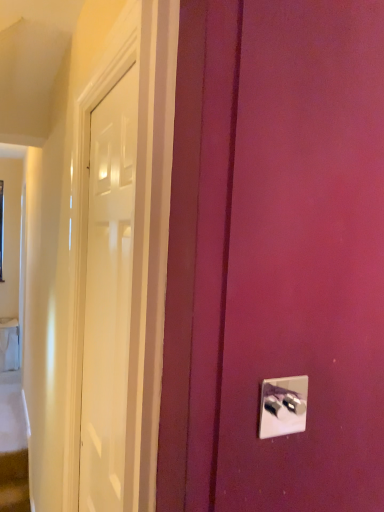
This screenshot has width=384, height=512. Describe the element at coordinates (283, 406) in the screenshot. I see `metallic silver light switch at lower right` at that location.

Image resolution: width=384 pixels, height=512 pixels. I want to click on metallic silver light switch at lower right, so click(x=283, y=406).

Image resolution: width=384 pixels, height=512 pixels. What are the coordinates of `white glossy door at left` in the screenshot? It's located at click(x=111, y=303).

What do you see at coordinates (111, 303) in the screenshot?
I see `white glossy door at left` at bounding box center [111, 303].

This screenshot has height=512, width=384. Identify the location of metallic silver light switch at lower right. (283, 406).

Which is more to the left, metallic silver light switch at lower right or white glossy door at left?

From the viewer's perspective, white glossy door at left appears more on the left side.

Who is more distant, metallic silver light switch at lower right or white glossy door at left?

white glossy door at left is further from the camera.

Is point (300, 392) less distant than point (122, 366)?

Yes.

From the image's perspective, which one is positioned lower, metallic silver light switch at lower right or white glossy door at left?

white glossy door at left.

From a real-world perspective, does metallic silver light switch at lower right stand above white glossy door at left?

Yes, from a real-world perspective, metallic silver light switch at lower right is on top of white glossy door at left.

Does metallic silver light switch at lower right have a greater width compared to white glossy door at left?

No.

Who is shorter, metallic silver light switch at lower right or white glossy door at left?

With less height is metallic silver light switch at lower right.

Is metallic silver light switch at lower right bigger than white glossy door at left?

Incorrect, metallic silver light switch at lower right is not larger than white glossy door at left.

From the picture: Is metallic silver light switch at lower right located outside white glossy door at left?

That's correct, metallic silver light switch at lower right is outside of white glossy door at left.

Can you see metallic silver light switch at lower right touching white glossy door at left?

metallic silver light switch at lower right is not next to white glossy door at left, and they're not touching.

Is metallic silver light switch at lower right positioned with its back to white glossy door at left?

Yes.

Identify the location of door behind the metallic silver light switch at lower right. (111, 303).

Considering the relative positions of white glossy door at left and metallic silver light switch at lower right in the image provided, is white glossy door at left to the left of metallic silver light switch at lower right from the viewer's perspective?

Correct, you'll find white glossy door at left to the left of metallic silver light switch at lower right.

Does white glossy door at left come in front of metallic silver light switch at lower right?

No, white glossy door at left is further to the viewer.

Which point is more distant from viewer, (132, 261) or (292, 381)?

The point (132, 261) is behind.

Looking at this image, from the image's perspective, between white glossy door at left and metallic silver light switch at lower right, who is located below?

white glossy door at left appears lower in the image.

Based on the photo, from a real-world perspective, which is physically above, white glossy door at left or metallic silver light switch at lower right?

metallic silver light switch at lower right, from a real-world perspective.

Considering the sizes of white glossy door at left and metallic silver light switch at lower right in the image, is white glossy door at left wider or thinner than metallic silver light switch at lower right?

Considering their sizes, white glossy door at left looks broader than metallic silver light switch at lower right.

Does white glossy door at left have a greater height compared to metallic silver light switch at lower right?

Indeed, white glossy door at left has a greater height compared to metallic silver light switch at lower right.

Between white glossy door at left and metallic silver light switch at lower right, which one has larger size?

white glossy door at left is bigger.

Is white glossy door at left outside of metallic silver light switch at lower right?

white glossy door at left lies outside metallic silver light switch at lower right's area.

Is white glossy door at left next to metallic silver light switch at lower right?

No, white glossy door at left is not with metallic silver light switch at lower right.

Could you tell me if white glossy door at left is facing metallic silver light switch at lower right?

No, white glossy door at left is not oriented towards metallic silver light switch at lower right.

What's the angular difference between white glossy door at left and metallic silver light switch at lower right's facing directions?

91.1 degrees.

How far apart are white glossy door at left and metallic silver light switch at lower right?

They are 38.69 inches apart.

At what (x,y) coordinates should I click in order to perform the action: click on light switch on the right of white glossy door at left. Please return your answer as a coordinate pair (x, y). The width and height of the screenshot is (384, 512). Looking at the image, I should click on coord(283,406).

Where is `door below the metallic silver light switch at lower right (from the image's perspective)`? door below the metallic silver light switch at lower right (from the image's perspective) is located at coordinates (111, 303).

Locate an element on the screen. The width and height of the screenshot is (384, 512). light switch that appears on the right of white glossy door at left is located at coordinates (283, 406).